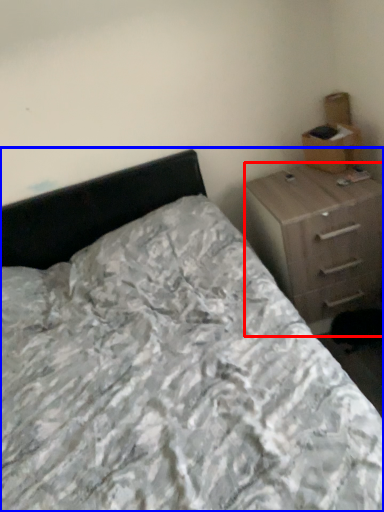
Question: Which object appears closest to the camera in this image, chest of drawers (highlighted by a red box) or bed (highlighted by a blue box)?

Choices:
 (A) chest of drawers
 (B) bed

Answer: (B)